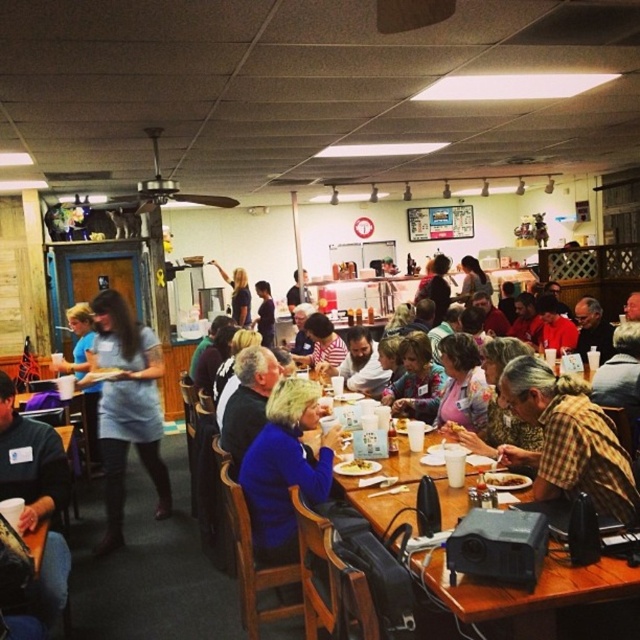
Question: Can you confirm if wooden table at center is smaller than slightly browned bread at table center?

Choices:
 (A) no
 (B) yes

Answer: (A)

Question: In this image, where is blue shirt at center located relative to slightly browned bread at table center?

Choices:
 (A) above
 (B) below

Answer: (A)

Question: Which of these objects is positioned farthest from the dark blue shirt at lower left?

Choices:
 (A) yellow matte plate at center
 (B) matte blue dress at left
 (C) blue shirt at center
 (D) brown plaid shirt at lower right

Answer: (C)

Question: Which point is farther to the camera?

Choices:
 (A) light blue shirt at center
 (B) slightly browned bread at table center
 (C) dark blue shirt at lower left
 (D) wooden table at center

Answer: (A)

Question: Which point is farther from the camera taking this photo?

Choices:
 (A) (522, 484)
 (B) (545, 413)

Answer: (A)

Question: Is light blue shirt at center closer to camera compared to slightly browned bread at table center?

Choices:
 (A) no
 (B) yes

Answer: (A)